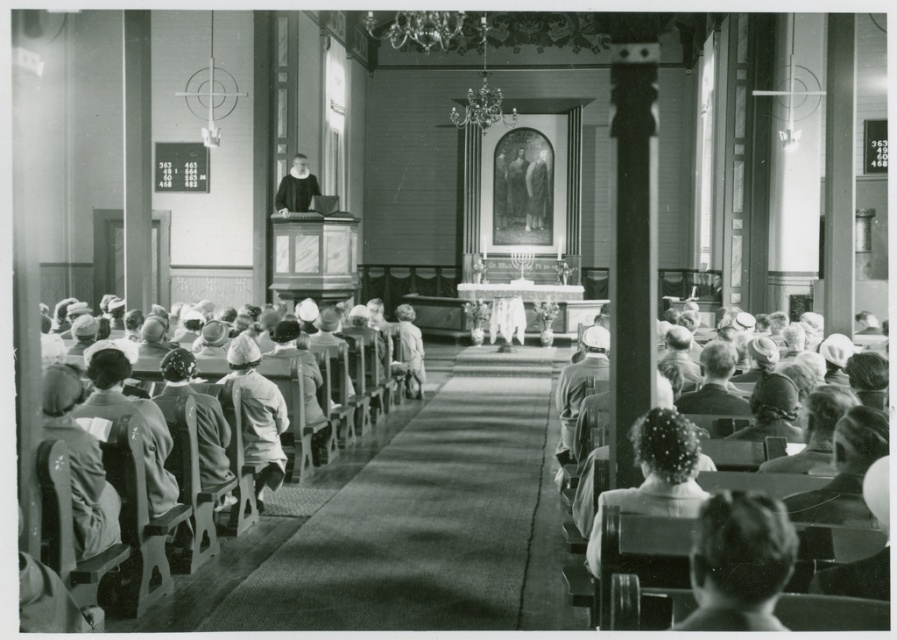
You are a photographer standing at the back of the church during a service. You want to take a photo of the two people at the lower right corner of the image, specifically the short hair at lower right and the light brown hair at lower right. Which person is closer to the ground?

The short hair at lower right is not as tall as light brown hair at lower right, so the short hair at lower right is closer to the ground.